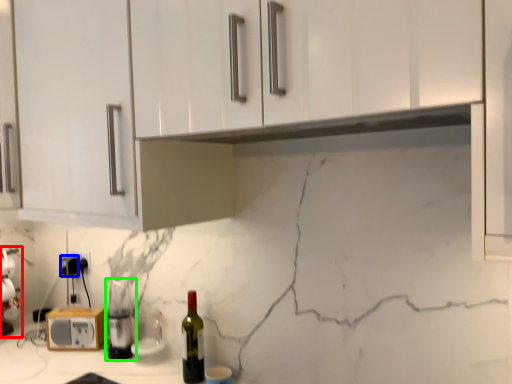
Question: Estimate the real-world distances between objects in this image. Which object is closer to blender (highlighted by a red box), electric outlet (highlighted by a blue box) or appliance (highlighted by a green box)?

Choices:
 (A) electric outlet
 (B) appliance

Answer: (A)